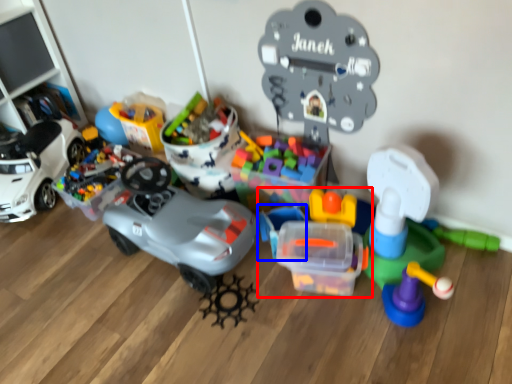
Question: Which point is closer to the camera, toy (highlighted by a red box) or toy (highlighted by a blue box)?

Choices:
 (A) toy
 (B) toy

Answer: (A)